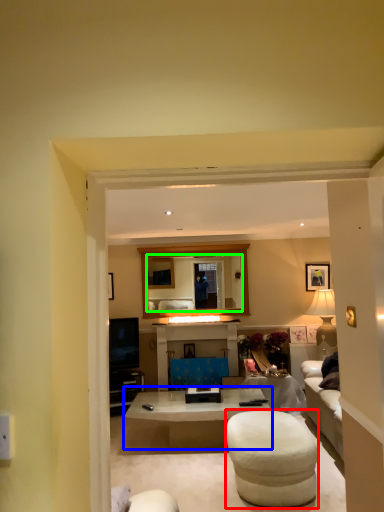
Question: Which is nearer to the bar stool (highlighted by a red box)? coffee table (highlighted by a blue box) or mirror (highlighted by a green box).

Choices:
 (A) coffee table
 (B) mirror

Answer: (A)